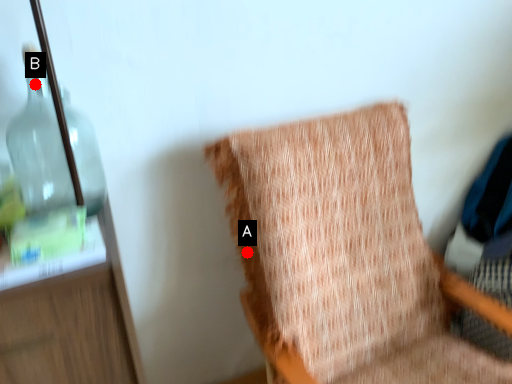
Question: Two points are circled on the image, labeled by A and B beside each circle. Which point appears farthest from the camera in this image?

Choices:
 (A) A is further
 (B) B is further

Answer: (A)